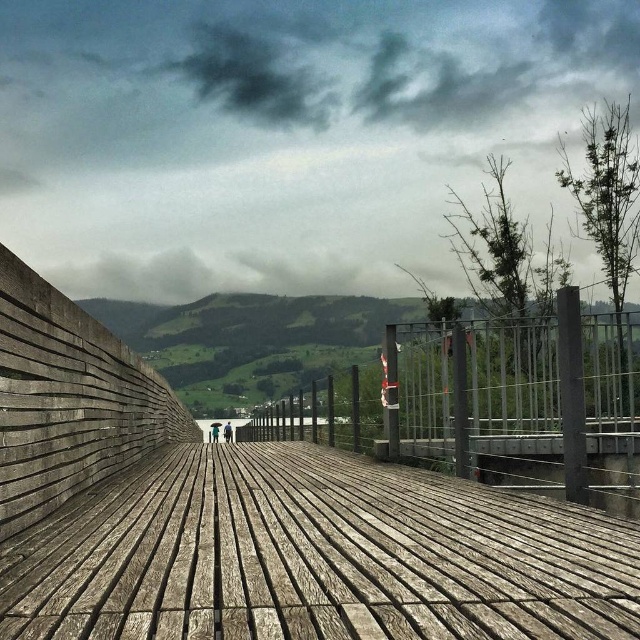
You are a maintenance worker needing to inspect the space between the weathered wood dock at center and the metallic gray rail at center. Your inspection tool requires a minimum clearance of 15 feet to operate safely. Based on the scene, can you use your tool in this area?

The distance between the weathered wood dock at center and the metallic rail at center is 18.70 feet, which exceeds the required 15 feet clearance. Therefore, the tool can be safely used in this area.

You are standing on the wooden walkway and want to move towards the body of water. There are two points marked on the walkway, point A at coordinates point (600, 557) and point B at coordinates point (531, 392). Which point should you walk towards to get closer to the water?

You should walk towards point A at coordinates point (600, 557) because it is closer to the viewer than point B at coordinates point (531, 392), so moving towards point A would bring you closer to the water.